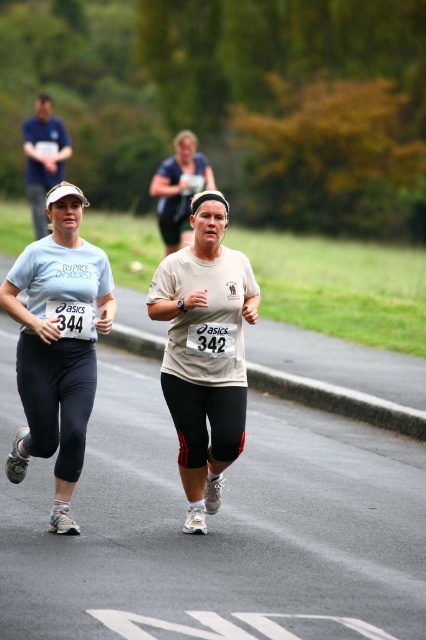
Question: Observing the image, what is the correct spatial positioning of matte white tank top at center in reference to dark blue shirt at upper left?

Choices:
 (A) above
 (B) below

Answer: (B)

Question: Is white matte running shirt at center closer to the viewer compared to dark blue shirt at upper left?

Choices:
 (A) no
 (B) yes

Answer: (B)

Question: Among these points, which one is farthest from the camera?

Choices:
 (A) (209, 182)
 (B) (68, 496)
 (C) (46, 189)

Answer: (C)

Question: Which of the following is the farthest from the observer?

Choices:
 (A) dark blue shirt at upper left
 (B) white matte running shirt at center
 (C) white matte t-shirt at center

Answer: (A)

Question: Which is nearer to the white matte running shirt at center?

Choices:
 (A) matte white tank top at center
 (B) dark blue shirt at upper left

Answer: (A)

Question: Can you confirm if white matte running shirt at center is thinner than matte white tank top at center?

Choices:
 (A) yes
 (B) no

Answer: (A)